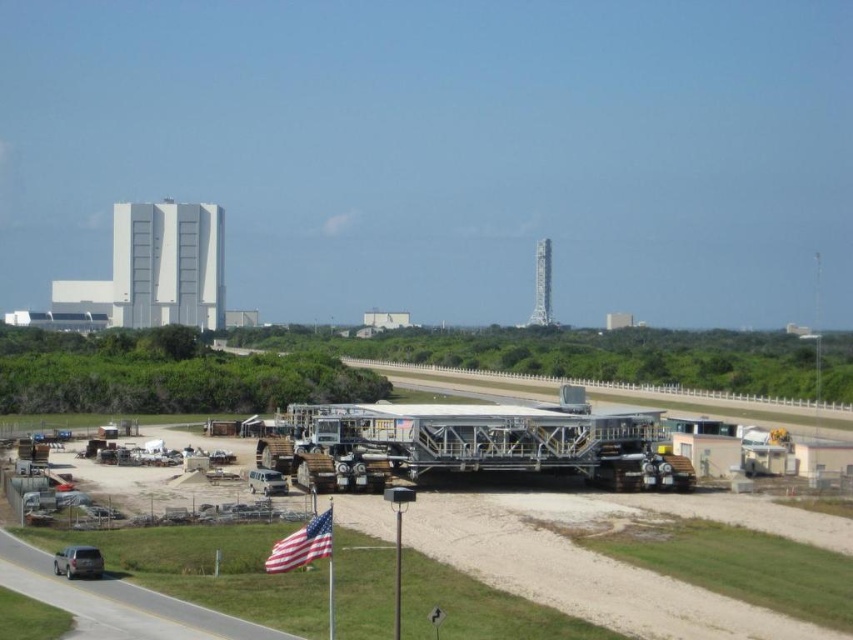
You are a technician at the Kennedy Space Center who needs to move equipment from the trailer truck to the mobile launcher platform. Given their positions, can you directly walk from the metallic silver trailer truck at center to the mobile launcher platform without crossing any obstacles?

The metallic silver trailer truck at center is located at point (x=469, y=444). Since the mobile launcher platform is in the midground and the trailer truck is at center, there might be a clear path between them. However, without specific obstacle information, it is uncertain if there are any obstructions. Please check the layout for any potential barriers between the two points.

You are an engineer at NASA planning to move the metallic gray structure at center and the american flag at lower center to a new location. The transport vehicle can only carry items up to 10 meters wide. Based on their widths, which object can definitely fit within the transport vehicle?

The american flag at lower center can definitely fit within the transport vehicle since the metallic gray structure at center is wider than it, and the transport vehicle can carry up to 10 meters. However, without knowing the exact width of the american flag, we can only confirm that the metallic gray structure at center is wider and thus may exceed the limit, while the flag is narrower and likely under 10 meters.

You are an engineer at the Kennedy Space Center and need to place a new equipment container that is 13 meters long between the metallic gray structure at center and the american flag at lower center. Can you fit the container between them without moving either object?

The metallic gray structure at center and the american flag at lower center are 12.97 meters apart. Since the container is 13 meters long, it cannot fit between them as the distance is slightly shorter than the container.